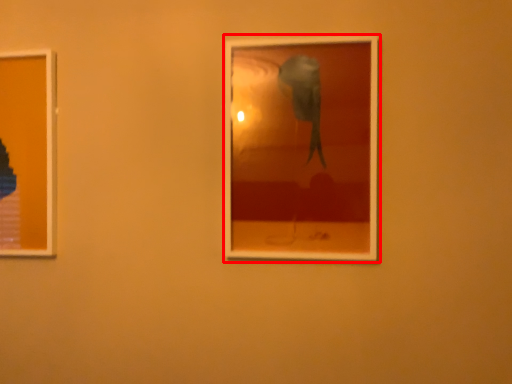
Question: Where is picture frame (annotated by the red box) located in relation to picture frame in the image?

Choices:
 (A) left
 (B) right

Answer: (B)